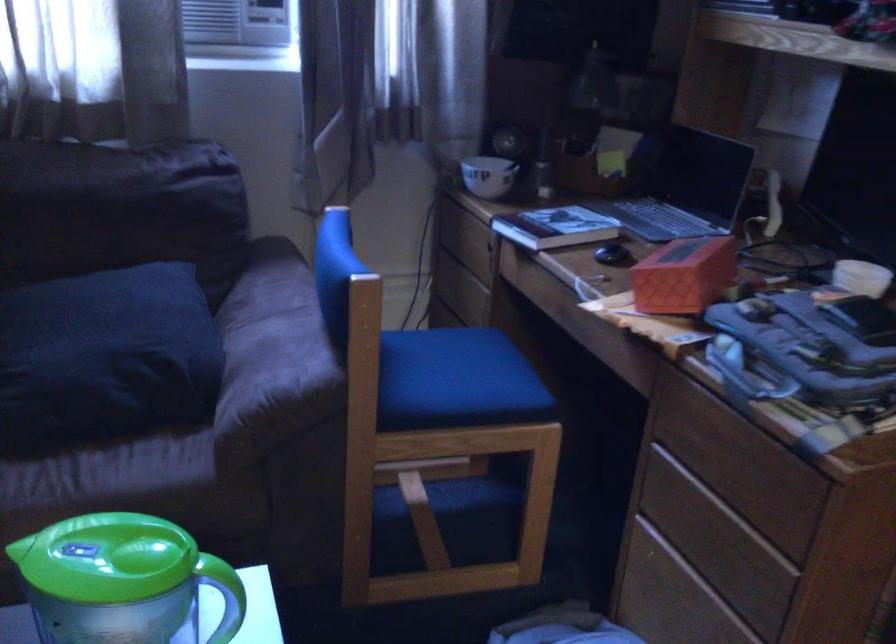
Locate an element on the screen. This screenshot has height=644, width=896. sofa sitting surface is located at coordinates (109, 471).